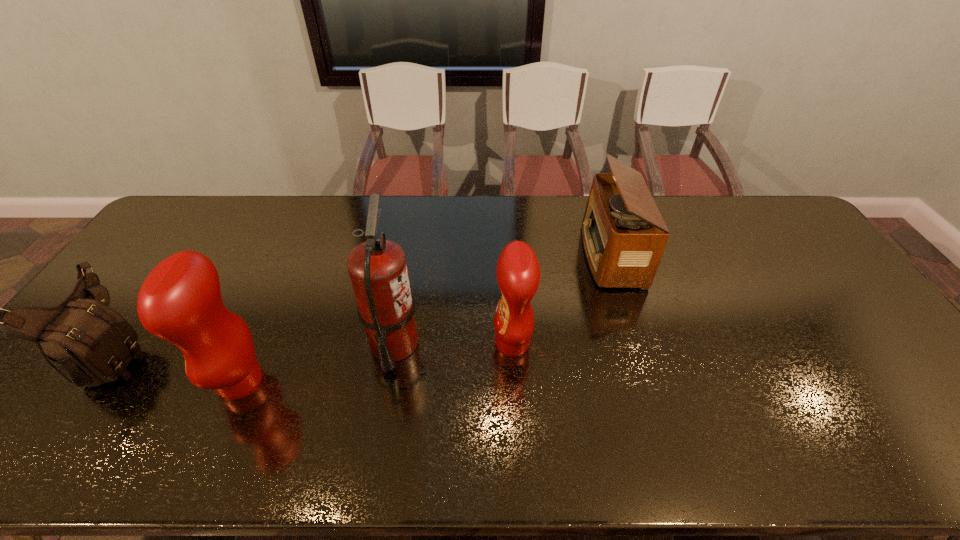
Where is `free space located 0.110m on the label side of the left condiment`? free space located 0.110m on the label side of the left condiment is located at coordinates (172, 381).

At what (x,y) coordinates should I click in order to perform the action: click on free location located on the label side of the right condiment. Please return your answer as a coordinate pair (x, y). Looking at the image, I should click on (403, 343).

Where is `vacant point located 0.100m on the label side of the right condiment`? vacant point located 0.100m on the label side of the right condiment is located at coordinates (456, 343).

You are a GUI agent. You are given a task and a screenshot of the screen. Output one action in this format:
    pyautogui.click(x=<x>, y=<y>)
    Task: Click on the free spot located on the label side of the right condiment
    
    Given the screenshot: What is the action you would take?
    pyautogui.click(x=403, y=343)

Identify the location of vacant space situated 0.330m on the front panel of the farthest object. Image resolution: width=960 pixels, height=540 pixels. (482, 254).

The width and height of the screenshot is (960, 540). In order to click on free space located 0.310m on the front panel of the farthest object in this screenshot , I will do `click(489, 254)`.

At what (x,y) coordinates should I click in order to perform the action: click on vacant position located on the front panel of the farthest object. Please return your answer as a coordinate pair (x, y). The height and width of the screenshot is (540, 960). Looking at the image, I should click on (544, 254).

Where is `vacant space located on the front-facing side of the shoulder bag`? vacant space located on the front-facing side of the shoulder bag is located at coordinates (228, 353).

Locate an element on the screen. The image size is (960, 540). free location located toward the nozzle of the fire extinguisher is located at coordinates (476, 344).

Image resolution: width=960 pixels, height=540 pixels. Find the location of `object situated at the far edge`. object situated at the far edge is located at coordinates pyautogui.click(x=624, y=235).